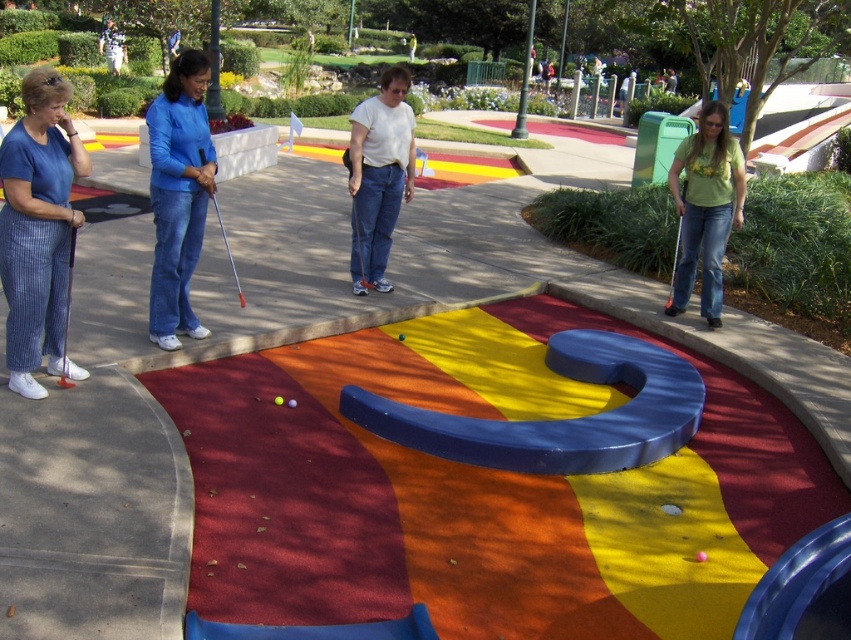
Does point (363, 221) lie behind point (290, 406)?

That is True.

How much distance is there between white matte golf club at center and yellow matte golf ball at center?

white matte golf club at center and yellow matte golf ball at center are 7.67 feet apart from each other.

Between point (383, 269) and point (289, 403), which one is positioned behind?

Point (383, 269)

This screenshot has height=640, width=851. Find the location of `white matte golf club at center`. white matte golf club at center is located at coordinates (378, 176).

Is green matte shirt at right positioned before matte white golf ball at center?

No.

The height and width of the screenshot is (640, 851). I want to click on green matte shirt at right, so click(706, 208).

Where is `green matte shirt at right`? green matte shirt at right is located at coordinates (706, 208).

Is white matte golf club at center further to camera compared to metallic silver golf club at center?

Yes, it is.

Can you confirm if white matte golf club at center is smaller than metallic silver golf club at center?

Yes, white matte golf club at center is smaller than metallic silver golf club at center.

The image size is (851, 640). Identify the location of white matte golf club at center. (378, 176).

Find the location of a particular element. This screenshot has width=851, height=640. white matte golf club at center is located at coordinates (378, 176).